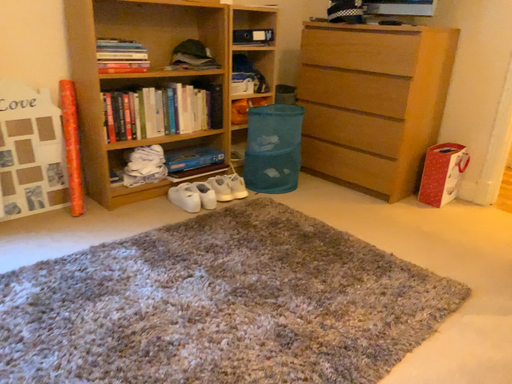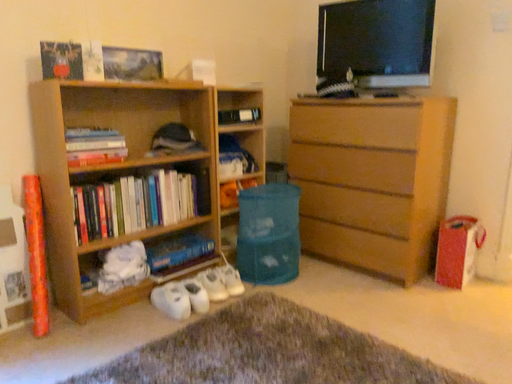
Question: How did the camera likely rotate when shooting the video?

Choices:
 (A) rotated downward
 (B) rotated upward

Answer: (B)